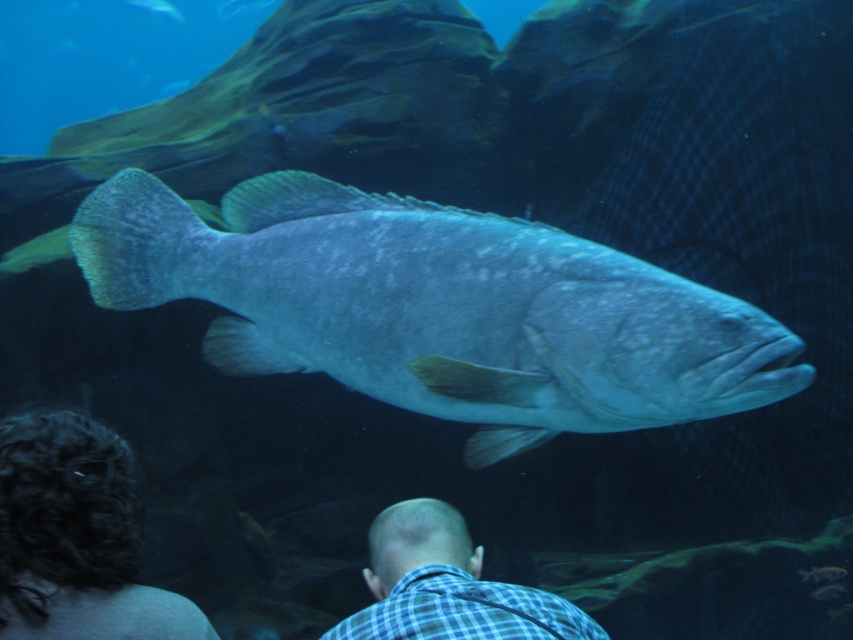
Based on the coordinates provided, where exactly is the shiny blue fish at center located in the image?

The shiny blue fish at center is located at point coordinates of 0.483 on the x axis and 0.512 on the y axis.

You are a photographer trying to capture a clear shot of the two people in the aquarium scene. Given that the dark curly hair at lower left and the blue checkered shirt at lower center are both in your viewfinder, which one would you focus on to ensure the subject is in focus?

The dark curly hair at lower left is much taller than the blue checkered shirt at lower center, so focusing on the dark curly hair at lower left would ensure the subject is in focus as it is closer to the camera.

You are a marine biologist observing the aquarium. You need to take a closeup photo of the shiny blue fish at center. The camera you have can focus on objects within 1.5 meters. Can you take the photo without moving closer?

The shiny blue fish at center is 1.79 meters from the camera, which is beyond the camera focus range of 1.5 meters. Therefore, you cannot take the photo without moving closer.